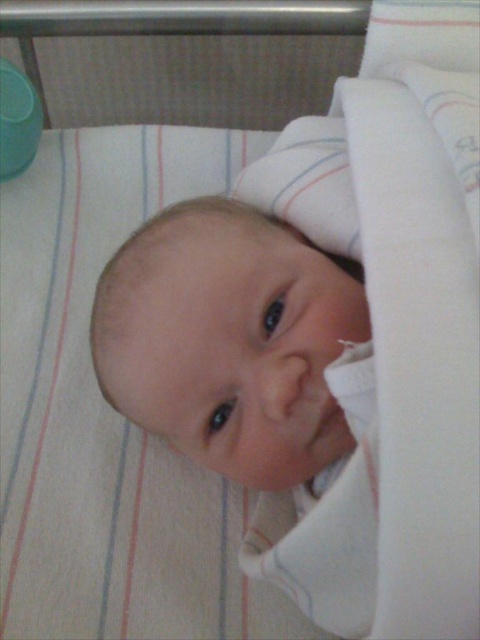
Is smooth skin baby at center closer to the viewer compared to smooth flesh nose at center?

That is False.

Which is in front, point (279, 285) or point (300, 356)?

Point (300, 356) is in front.

This screenshot has height=640, width=480. I want to click on smooth skin baby at center, so click(226, 337).